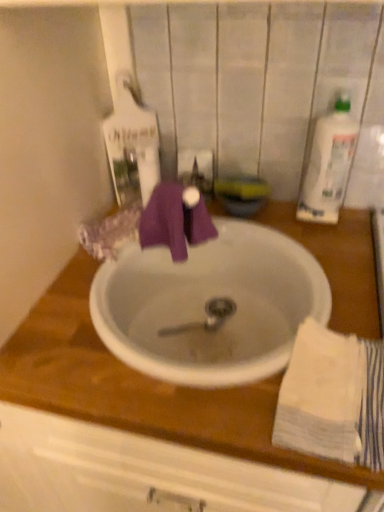
Where is `vacant space underneath white cotton towel at lower right (from a real-world perspective)`? vacant space underneath white cotton towel at lower right (from a real-world perspective) is located at coordinates (351, 406).